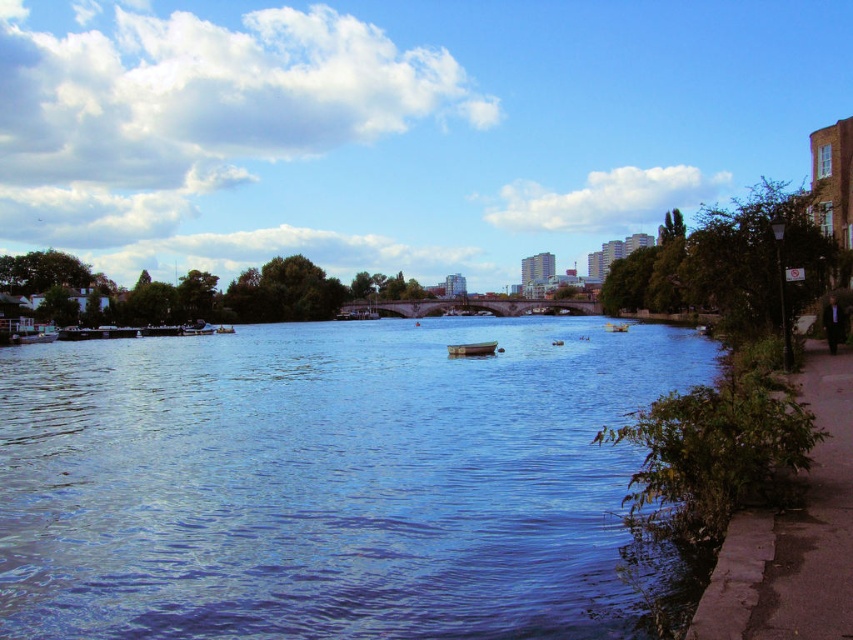
Who is more distant from viewer, (259, 620) or (621, 330)?

The point (621, 330) is behind.

Locate an element on the screen. blue water at center is located at coordinates (328, 480).

What do you see at coordinates (471, 348) in the screenshot? This screenshot has width=853, height=640. I see `wooden boat at center` at bounding box center [471, 348].

Image resolution: width=853 pixels, height=640 pixels. Find the location of `wooden boat at center`. wooden boat at center is located at coordinates (471, 348).

At what (x,y) coordinates should I click in order to perform the action: click on wooden boat at center. Please return your answer as a coordinate pair (x, y). Looking at the image, I should click on (471, 348).

Which is more to the right, blue water at center or wooden boat at center?

Positioned to the right is wooden boat at center.

Which is above, blue water at center or wooden boat at center?

Positioned higher is wooden boat at center.

The height and width of the screenshot is (640, 853). I want to click on blue water at center, so coord(328,480).